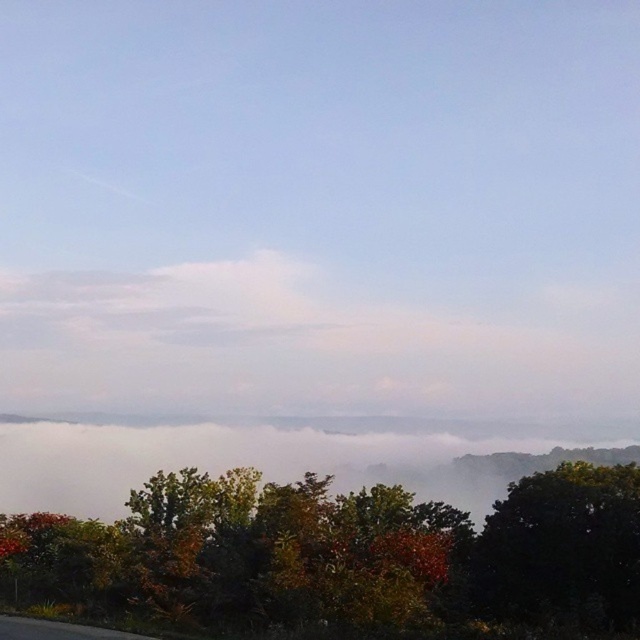
You are an airplane pilot flying at an altitude of 10,000 feet. You notice a white fluffy cloud at center and a green leafy tree at center in your view. Which object is higher in the sky?

The white fluffy cloud at center is much taller than the green leafy tree at center, so the white fluffy cloud at center is higher in the sky.

You are an astronomer analyzing the image. You need to locate the white fluffy cloud at center for a study. What are its coordinates in the image?

The white fluffy cloud at center is located at coordinates (301,348).